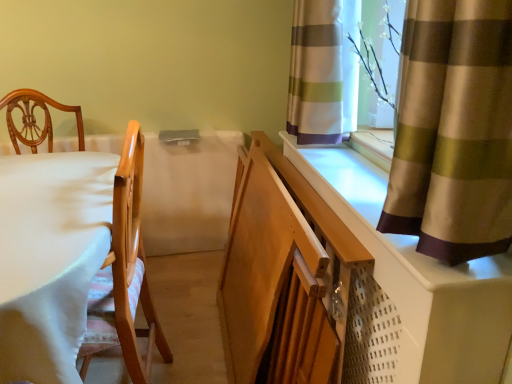
This screenshot has width=512, height=384. I want to click on vacant area in front of striped fabric curtain at upper right, the 2th curtain in the front-to-back sequence, so click(x=343, y=168).